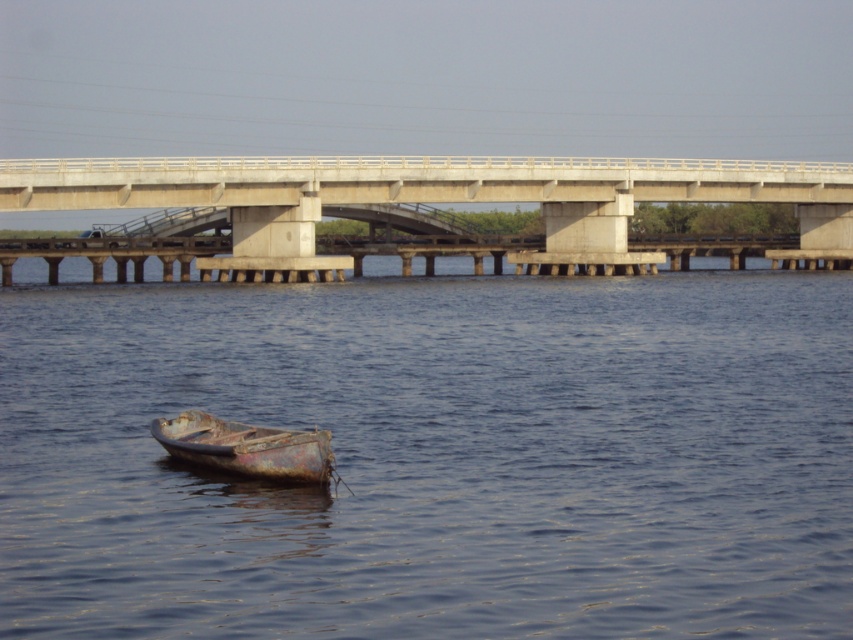
You are a delivery drone flying above the water. You need to land on the rusty metal boat at lower center without hitting the concrete bridge at center. Is this possible?

The concrete bridge at center is above the rusty metal boat at lower center, so the drone can safely land on the rusty metal boat at lower center by flying underneath the bridge.

You are standing at the edge of the bridge looking down at the water. There are two points marked on the water surface. The first point is at coordinates point (828, 424) and the second is at point (231, 445). Which point is closer to your position on the bridge?

Point (828, 424) is further to the camera than point (231, 445). Therefore, the point closer to your position on the bridge is point (231, 445).

You are a photographer planning to capture the blue metallic boat at lower left and the concrete bridge at center in a single shot. Given that the boat is closer to you, will you need to adjust your camera to focus on both objects simultaneously?

The blue metallic boat at lower left is smaller than the concrete bridge at center, but since the boat is closer to you, you may need to adjust your camera focus to ensure both are in sharp focus, as depth of field might be limited depending on your aperture setting.